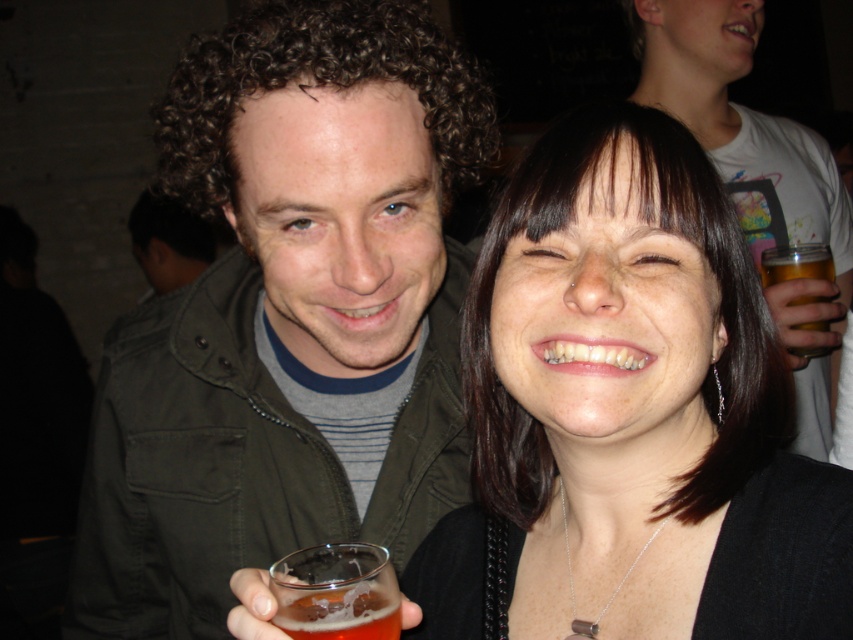
You are standing in the center of the room and want to hand a drink to the person wearing the matte green jacket at center. In which direction should you move to reach them?

The matte green jacket at center is located at coordinates point (289,317), so you should move towards the center of the room to reach them.

You are a photographer at the event and want to capture a photo of both the matte black hair at center and the matte gray jacket at center. If you want to ensure both are fully visible, which object should you focus on first considering their sizes?

The matte black hair at center has a smaller width than the matte gray jacket at center, so you should focus on the matte gray jacket at center first to ensure it is fully visible.